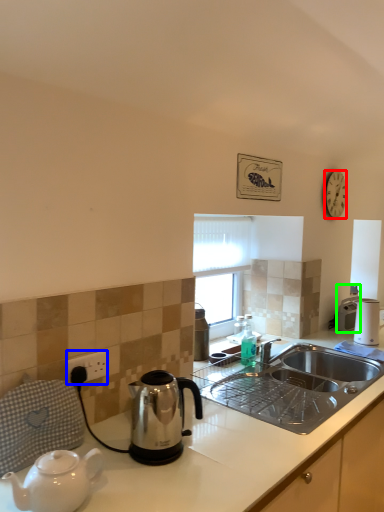
Question: Based on their relative distances, which object is farther from clock (highlighted by a red box)? Choose from power outlet (highlighted by a blue box) and coffee maker (highlighted by a green box).

Choices:
 (A) power outlet
 (B) coffee maker

Answer: (A)